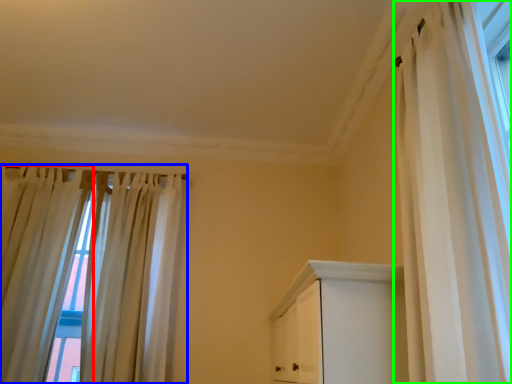
Question: Considering the real-world distances, which object is closest to curtain (highlighted by a red box)? curtain (highlighted by a blue box) or curtain (highlighted by a green box).

Choices:
 (A) curtain
 (B) curtain

Answer: (A)